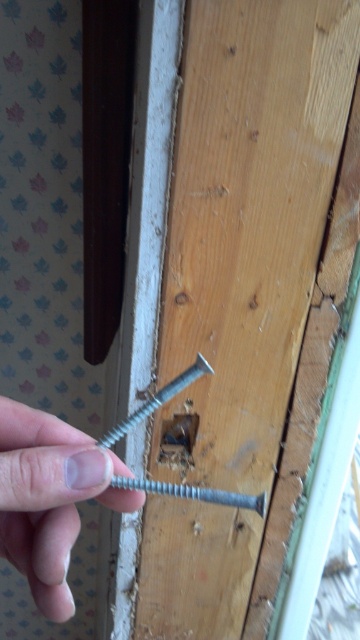
Question: Can you confirm if pale skin at center is positioned below silver metallic bolt at center?

Choices:
 (A) yes
 (B) no

Answer: (A)

Question: Which of the following is the closest to the observer?

Choices:
 (A) (68, 486)
 (B) (51, 472)

Answer: (B)

Question: Is pale skin at center behind silver metallic bolt at center?

Choices:
 (A) no
 (B) yes

Answer: (A)

Question: Is pale skin at center behind silver metallic bolt at center?

Choices:
 (A) no
 (B) yes

Answer: (A)

Question: Which object appears closest to the camera in this image?

Choices:
 (A) pale skin at center
 (B) silver metallic bolt at center

Answer: (A)